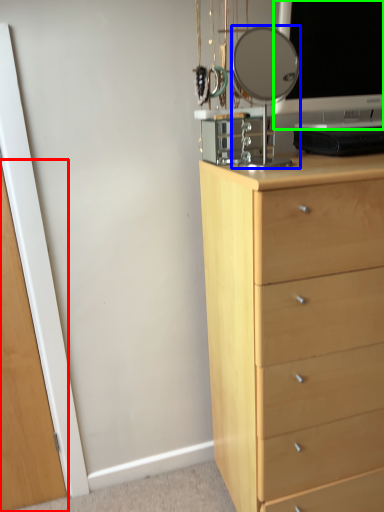
Question: Which object is the farthest from glass door (highlighted by a red box)? Choose among these: mirror (highlighted by a blue box) or computer monitor (highlighted by a green box).

Choices:
 (A) mirror
 (B) computer monitor

Answer: (A)